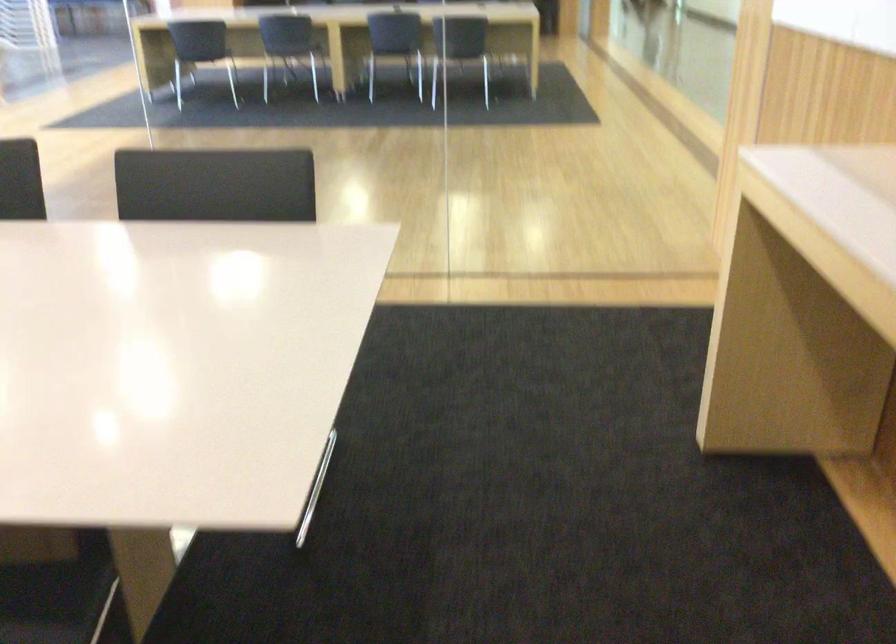
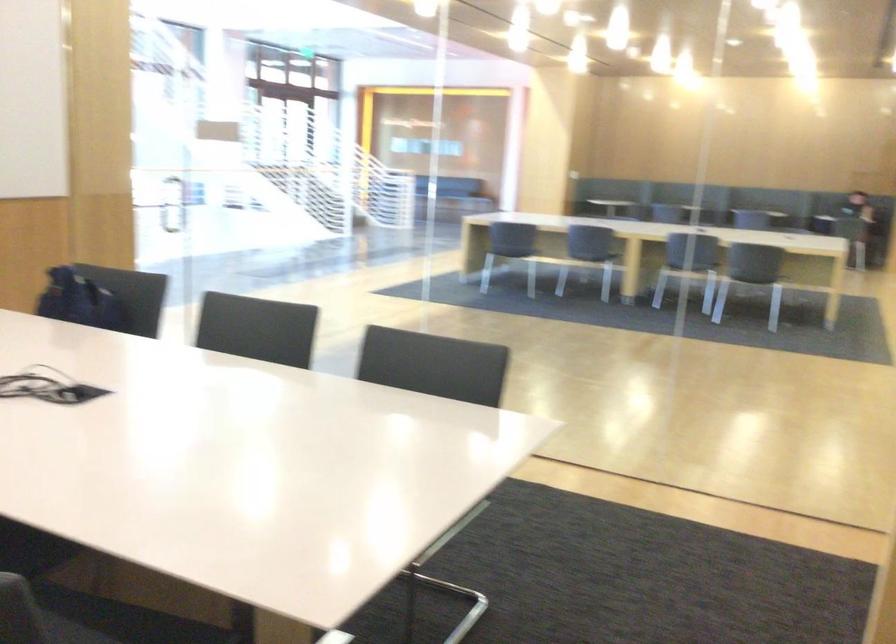
Which direction would the cameraman need to move to produce the second image?

The cameraman moved toward right, backward.